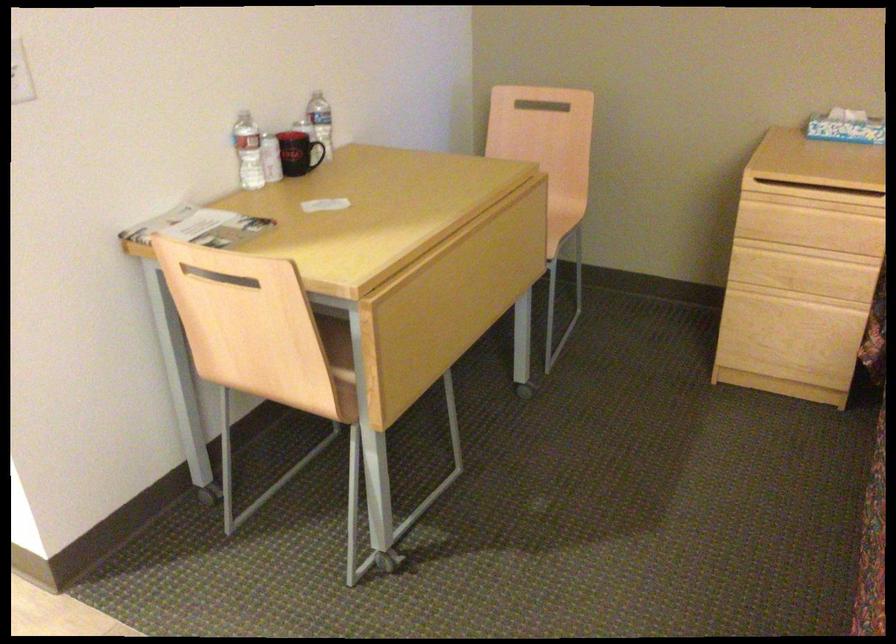
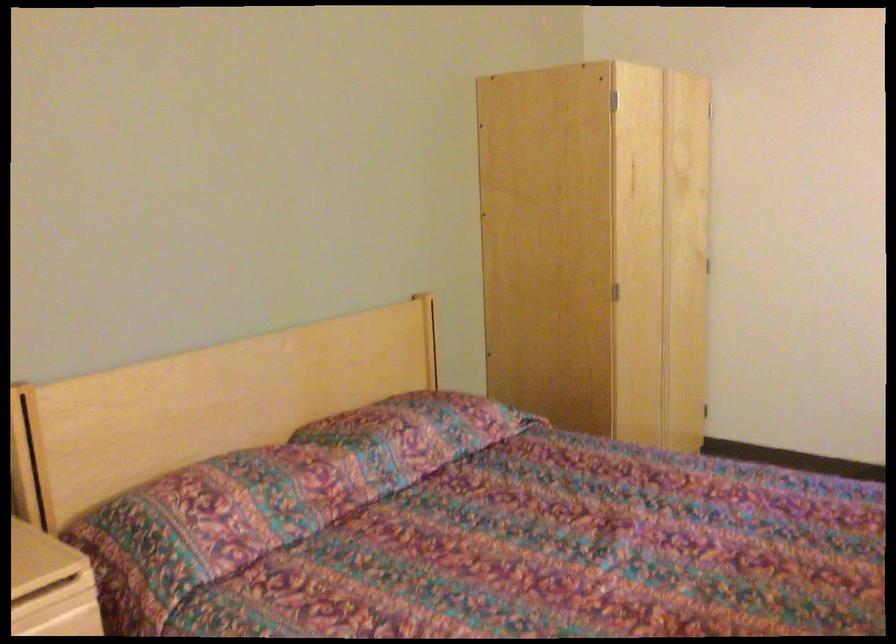
Question: The first image is from the beginning of the video and the second image is from the end. How did the camera likely rotate when shooting the video?

Choices:
 (A) Left
 (B) Right
 (C) Up
 (D) Down

Answer: (B)